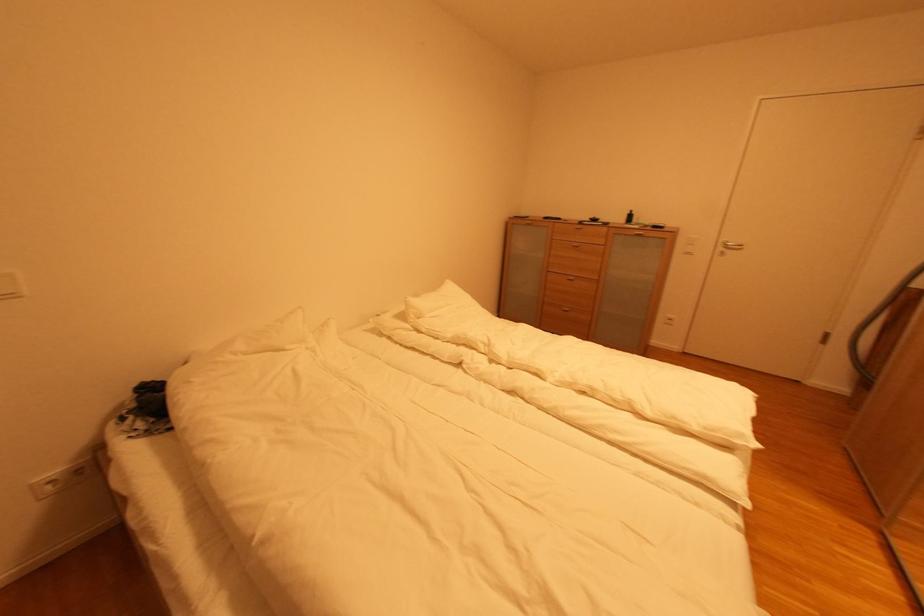
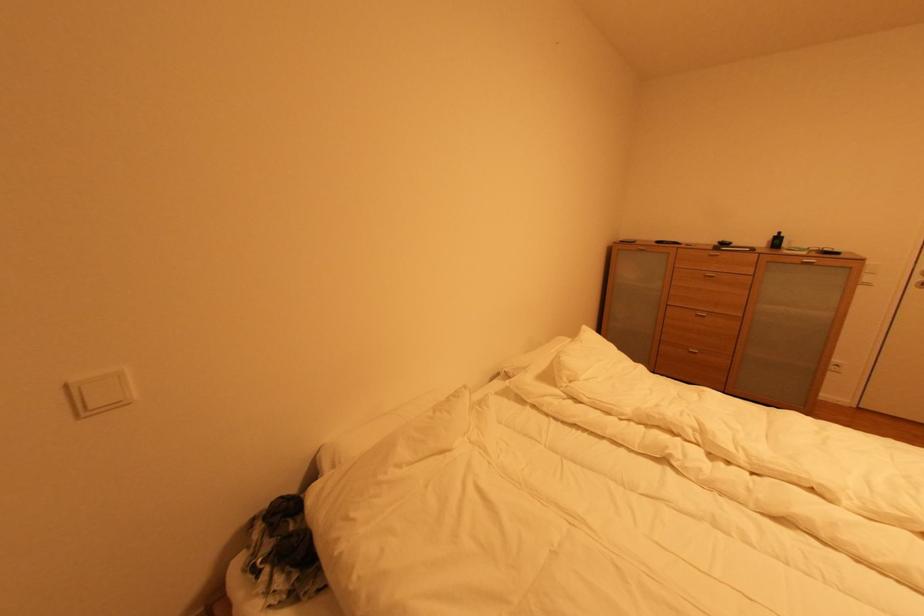
Question: The camera is either moving clockwise (left) or counter-clockwise (right) around the object. The first image is from the beginning of the video and the second image is from the end. Is the camera moving left or right when shooting the video?

Choices:
 (A) Left
 (B) Right

Answer: (B)